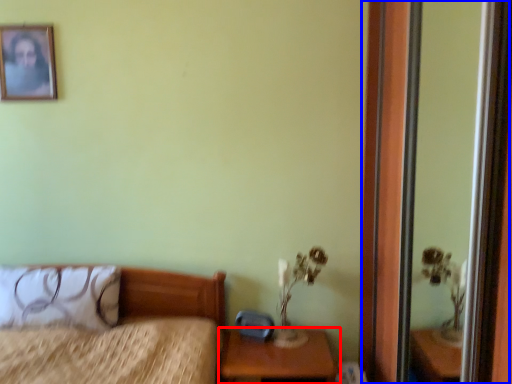
Question: Which object appears closest to the camera in this image, nightstand (highlighted by a red box) or screen door (highlighted by a blue box)?

Choices:
 (A) nightstand
 (B) screen door

Answer: (B)